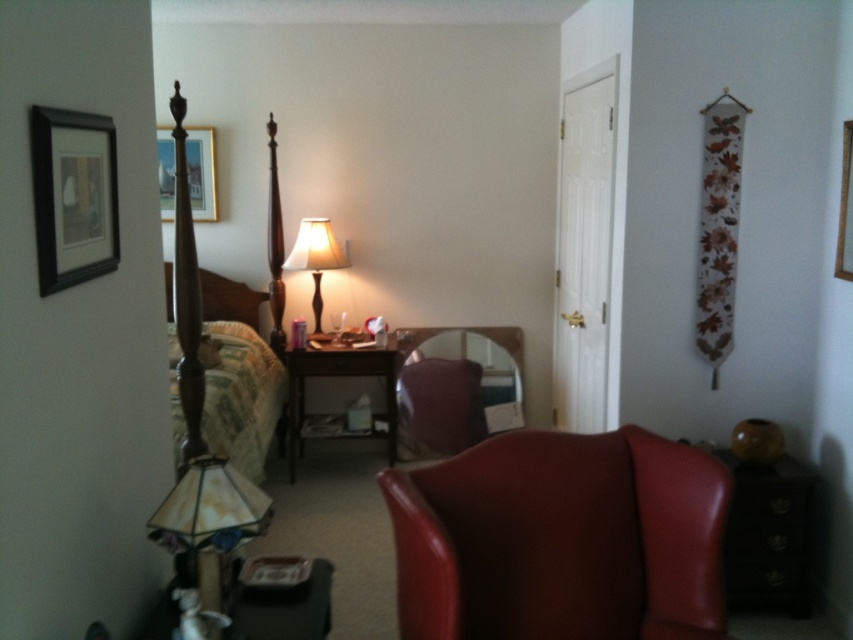
Question: Can you confirm if brown wooden dresser at lower right is smaller than wooden table at lower left?

Choices:
 (A) no
 (B) yes

Answer: (A)

Question: Can you confirm if wooden bed at left is bigger than stained glass lampshade at lower left?

Choices:
 (A) no
 (B) yes

Answer: (B)

Question: Which object is the farthest from the matte glass lamp at center?

Choices:
 (A) green fabric pillow at left
 (B) brown wooden dresser at lower right
 (C) stained glass lampshade at lower left

Answer: (C)

Question: Considering the real-world distances, which object is closest to the matte glass lamp at center?

Choices:
 (A) wooden table at center
 (B) wooden bed at left

Answer: (A)

Question: Does stained glass lampshade at lower left come behind wooden table at center?

Choices:
 (A) yes
 (B) no

Answer: (B)

Question: Which object is farther from the camera taking this photo?

Choices:
 (A) wooden bed at left
 (B) matte wooden picture frame at upper left

Answer: (B)